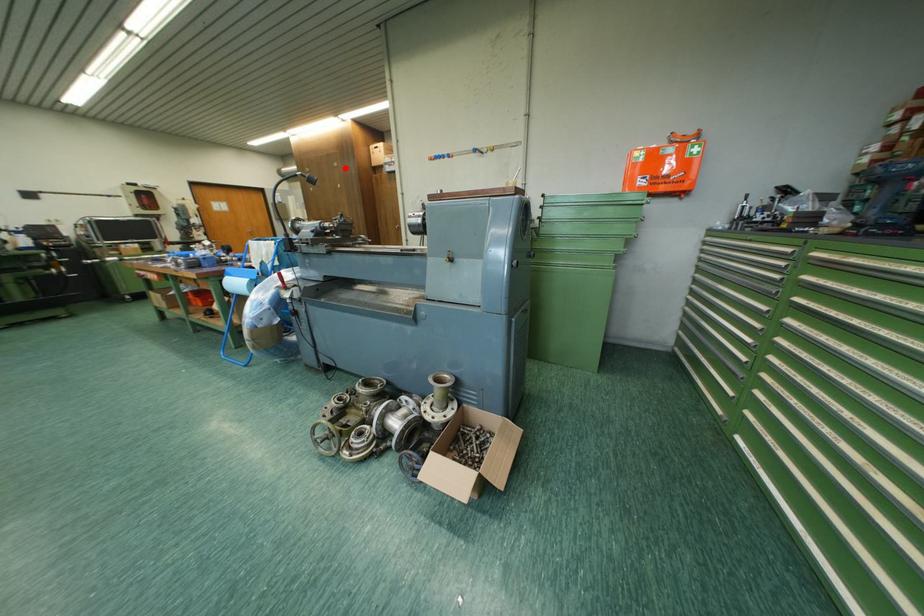
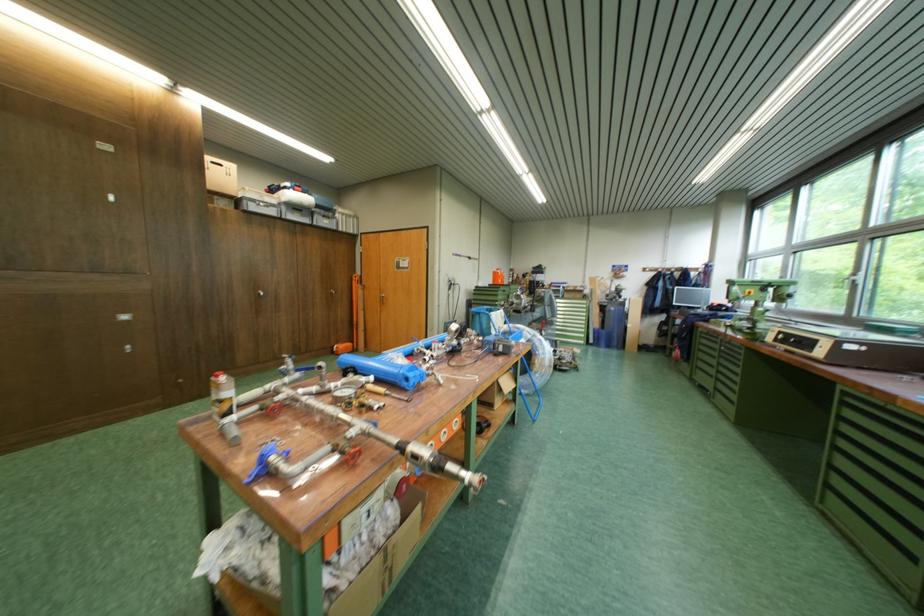
Question: I am providing you with two images of the same scene from different viewpoints. Image1 has a red point marked. In image2, the corresponding 3D location appears at what relative position? Reply with the corresponding letter.

Choices:
 (A) Closer
 (B) Farther

Answer: (B)